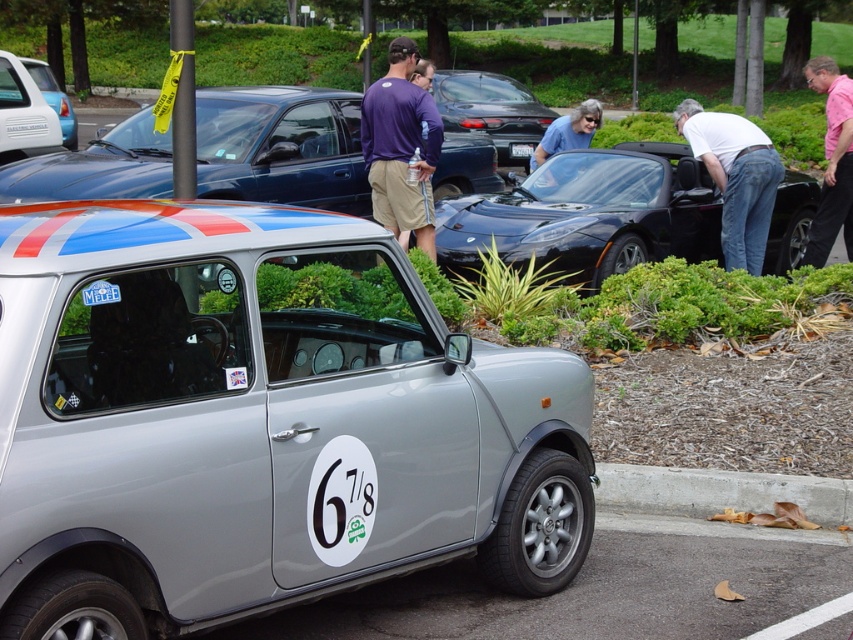
Question: Which point is farther to the camera?

Choices:
 (A) shiny black car at center
 (B) glossy black convertible at center
 (C) gray fabric shirt at center

Answer: (A)

Question: Does gray fabric shirt at center appear on the left side of white plastic license plate at center?

Choices:
 (A) no
 (B) yes

Answer: (A)

Question: Which point appears farthest from the camera in this image?

Choices:
 (A) (521, 157)
 (B) (675, 500)

Answer: (A)

Question: Can you confirm if satin silver car at center is bigger than shiny black car at center?

Choices:
 (A) no
 (B) yes

Answer: (A)

Question: Which of these objects is positioned closest to the metallic silver car at center?

Choices:
 (A) white plastic license plate at center
 (B) gray concrete curb at lower right
 (C) white cotton shirt at right

Answer: (A)

Question: Can you confirm if gray concrete curb at lower right is smaller than pink shirt at upper right?

Choices:
 (A) yes
 (B) no

Answer: (A)